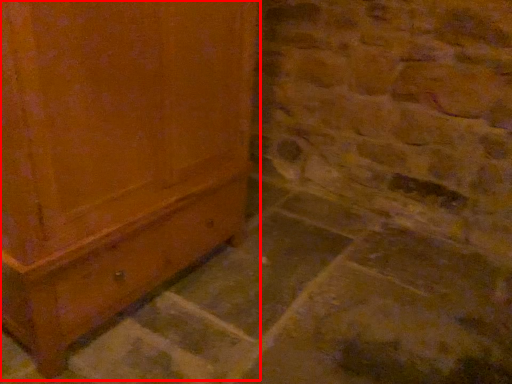
Question: From the image's perspective, what is the correct spatial positioning of furniture (annotated by the red box) in reference to concrete?

Choices:
 (A) above
 (B) below

Answer: (A)